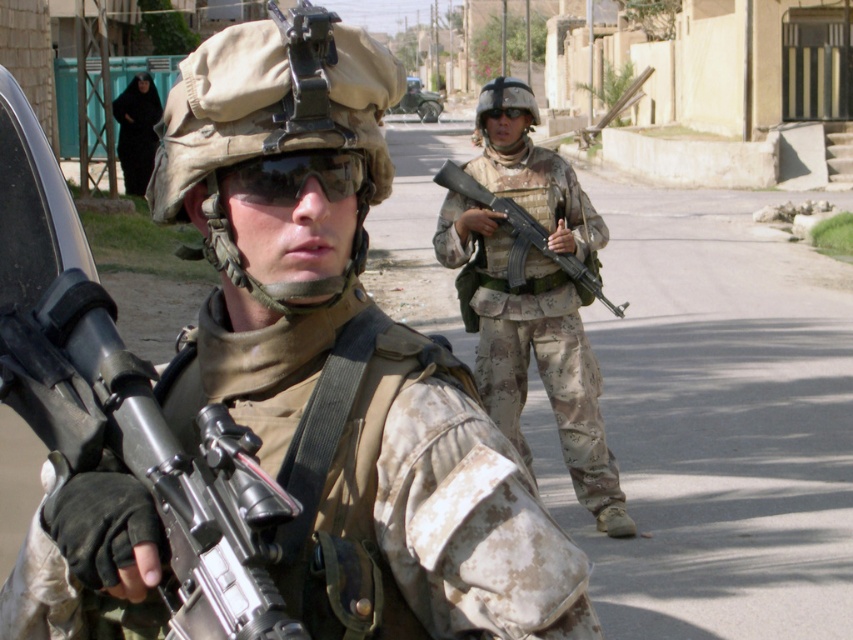
Question: Does matte black rifle at center appear on the left side of sunglassesmatte at center?

Choices:
 (A) no
 (B) yes

Answer: (B)

Question: Estimate the real-world distances between objects in this image. Which object is closer to the camouflage fabric uniform at center?

Choices:
 (A) camouflage uniform at center
 (B) camouflage-patterned rifle at center
 (C) black matte clothing at upper left
 (D) sunglassesmatte at center

Answer: (B)

Question: Can you confirm if camouflage fabric uniform at center is wider than black matte clothing at upper left?

Choices:
 (A) no
 (B) yes

Answer: (B)

Question: Estimate the real-world distances between objects in this image. Which object is farther from the camouflage uniform at center?

Choices:
 (A) matte black rifle at center
 (B) sunglassesmatte at center

Answer: (B)

Question: Estimate the real-world distances between objects in this image. Which object is farther from the matte black rifle at center?

Choices:
 (A) camouflage uniform at center
 (B) camouflage fabric uniform at center
 (C) sunglassesmatte at center
 (D) camouflage-patterned rifle at center

Answer: (D)

Question: Can you confirm if matte black rifle at center is smaller than sunglassesmatte at center?

Choices:
 (A) yes
 (B) no

Answer: (B)